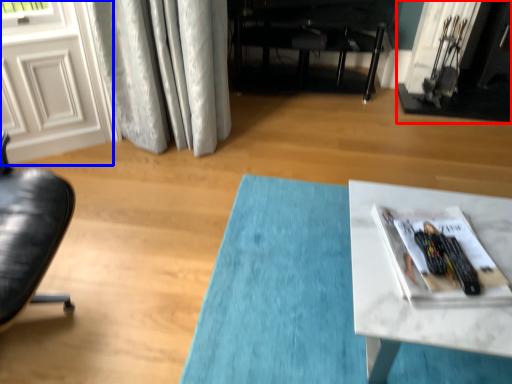
Question: Among these objects, which one is nearest to the camera, fireplace (highlighted by a red box) or screen door (highlighted by a blue box)?

Choices:
 (A) fireplace
 (B) screen door

Answer: (B)